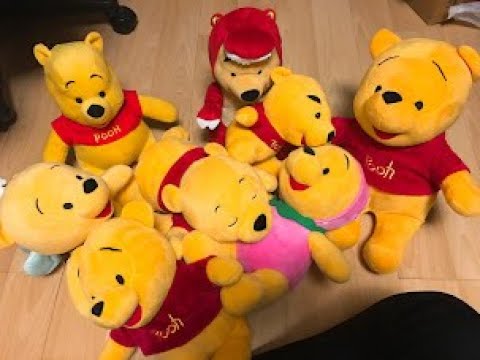
Identify the location of winnie the pooh stuffed animals. Image resolution: width=480 pixels, height=360 pixels. (86, 89), (69, 203), (116, 260), (232, 208), (326, 168), (296, 108), (424, 93), (232, 37).